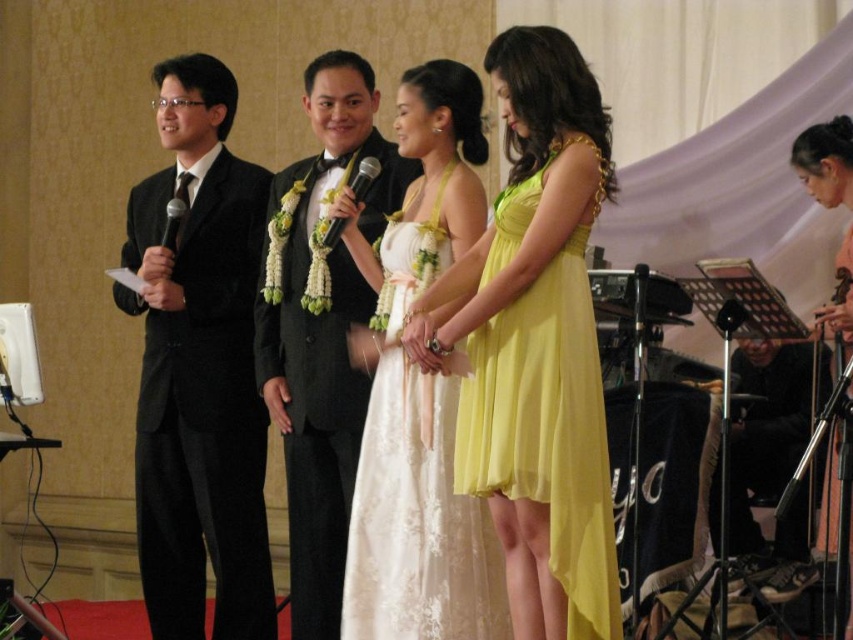
Question: Is yellow chiffon dress at center above black metallic microphone at center?

Choices:
 (A) yes
 (B) no

Answer: (B)

Question: Is the position of yellow chiffon dress at center more distant than that of black metallic microphone at center?

Choices:
 (A) no
 (B) yes

Answer: (A)

Question: Does black velvet suit at left lie in front of white lace dress at center?

Choices:
 (A) yes
 (B) no

Answer: (B)

Question: Which point is closer to the camera?

Choices:
 (A) [177, 232]
 (B) [416, 259]
 (C) [369, 161]
 (D) [834, 314]

Answer: (D)

Question: Which of the following is the farthest from the observer?

Choices:
 (A) yellow chiffon dress at center
 (B) black satin suit at center
 (C) black velvet suit at left
 (D) black metallic microphone at center

Answer: (C)

Question: Estimate the real-world distances between objects in this image. Which object is farther from the black metallic microphone at left?

Choices:
 (A) white lace dress at center
 (B) pink satin dress at lower right
 (C) black metallic microphone at center

Answer: (B)